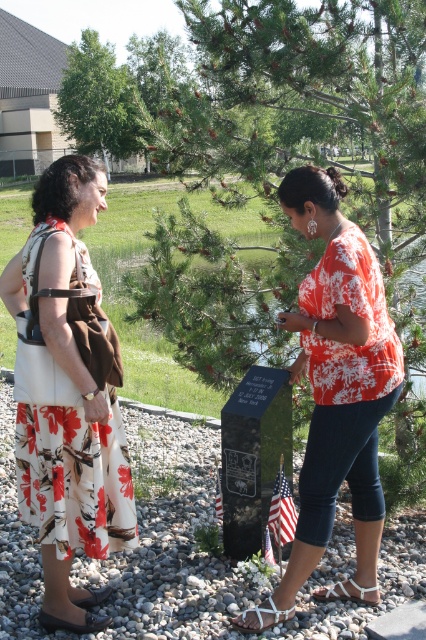
Can you confirm if white fabric sandal at lower center is shorter than white leather sandal at lower center?

Indeed, white fabric sandal at lower center has a lesser height compared to white leather sandal at lower center.

You are a GUI agent. You are given a task and a screenshot of the screen. Output one action in this format:
    pyautogui.click(x=<x>, y=<y>)
    Task: Click on the white fabric sandal at lower center
    This screenshot has height=640, width=426.
    Given the screenshot: What is the action you would take?
    (348, 593)

Where is `white fabric sandal at lower center`? Image resolution: width=426 pixels, height=640 pixels. white fabric sandal at lower center is located at coordinates pos(348,593).

How far apart are white floral dress at left and orange floral blouse at center?

white floral dress at left and orange floral blouse at center are 36.90 inches apart from each other.

Is white floral dress at left positioned behind orange floral blouse at center?

No, it is not.

Find the location of `white floral dress at left`. white floral dress at left is located at coordinates (66, 387).

You are a GUI agent. You are given a task and a screenshot of the screen. Output one action in this format:
    pyautogui.click(x=<x>, y=<y>)
    Task: Click on the orange floral blouse at center
    Image resolution: width=426 pixels, height=640 pixels.
    Given the screenshot: What is the action you would take?
    pyautogui.click(x=337, y=376)

Who is more distant from viewer, [314,225] or [271,625]?

Positioned behind is point [271,625].

Identify the location of orange floral blouse at center. (337, 376).